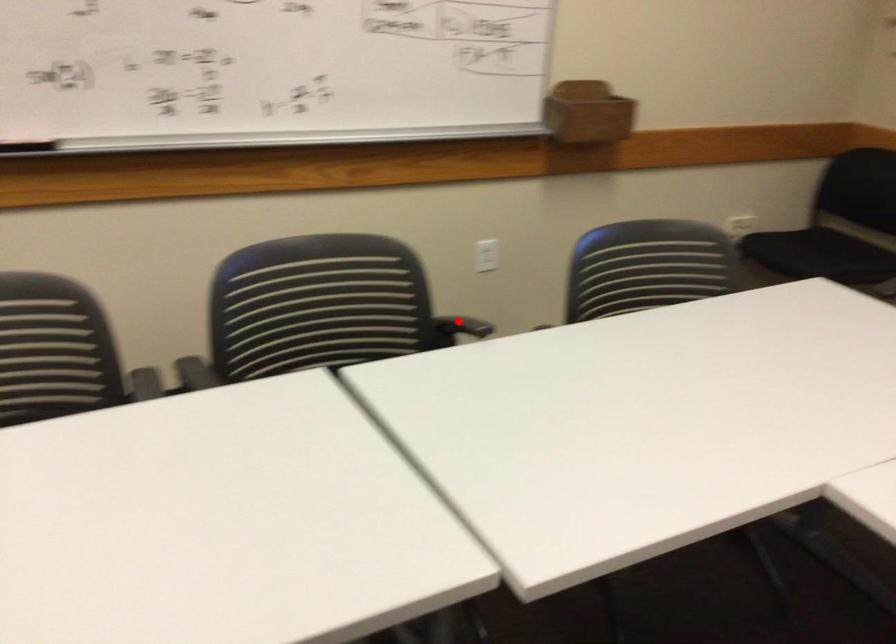
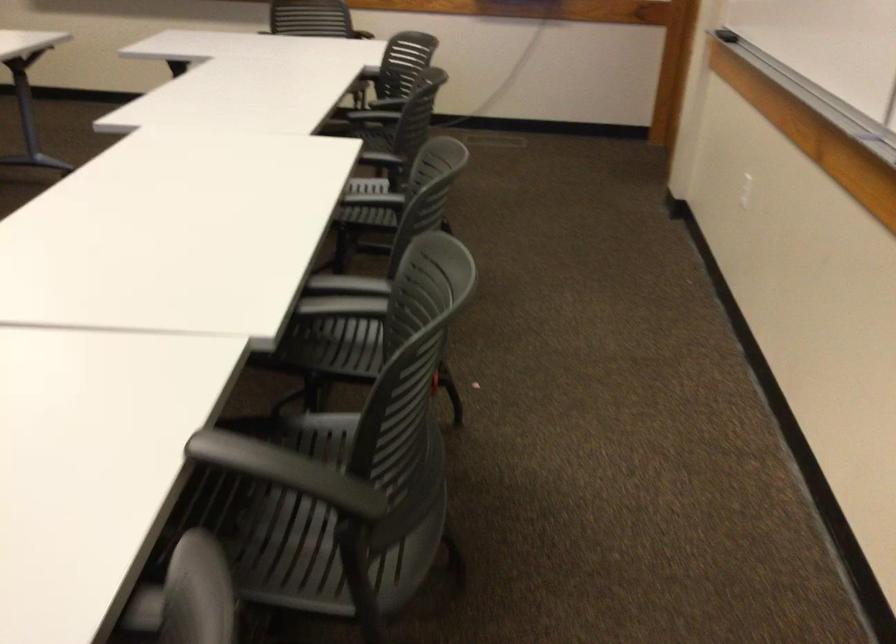
Find the pixel in the second image that matches the highlighted location in the first image.

(286, 471)